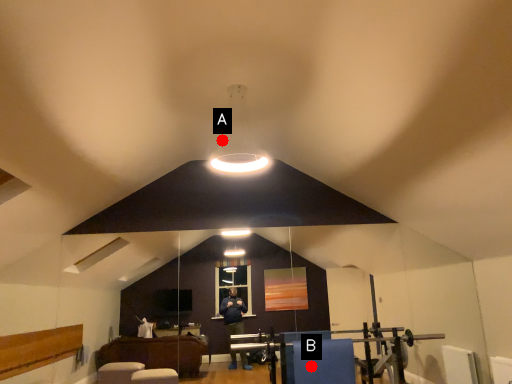
Question: Two points are circled on the image, labeled by A and B beside each circle. Which point appears farthest from the camera in this image?

Choices:
 (A) A is further
 (B) B is further

Answer: (A)